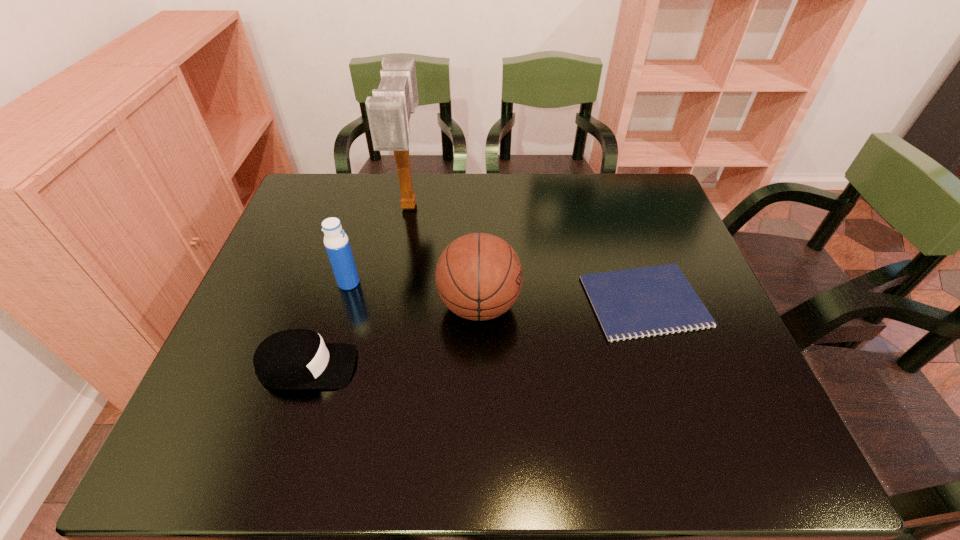
Image resolution: width=960 pixels, height=540 pixels. In order to click on object that is the fourth closest to the notepad in this screenshot , I will do `click(336, 242)`.

Select which object is the fourth closest to the shortest object. Please provide its 2D coordinates. Your answer should be formatted as a tuple, i.e. [(x, y)], where the tuple contains the x and y coordinates of a point satisfying the conditions above.

[(336, 242)]